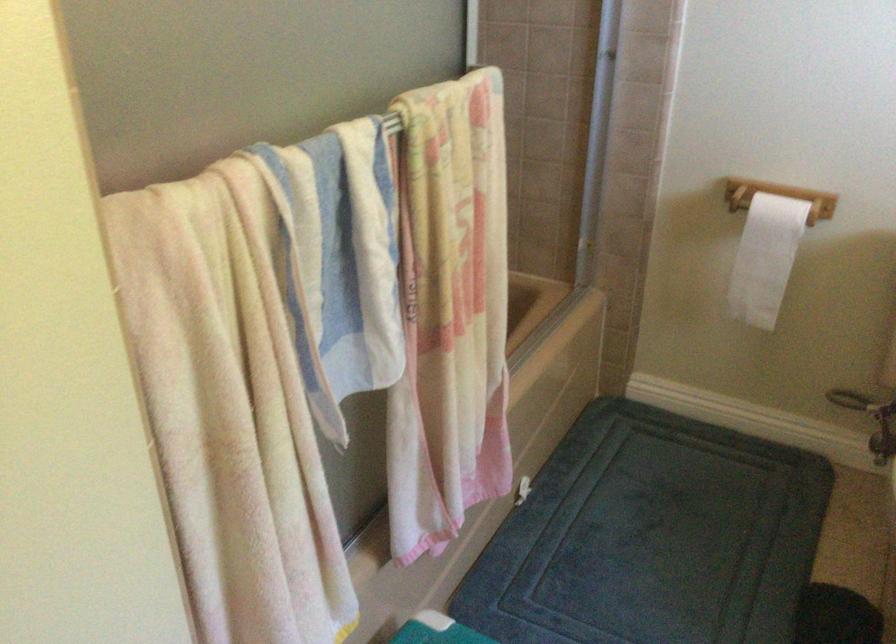
The width and height of the screenshot is (896, 644). What are the coordinates of `metal shower handle` in the screenshot? It's located at 871,420.